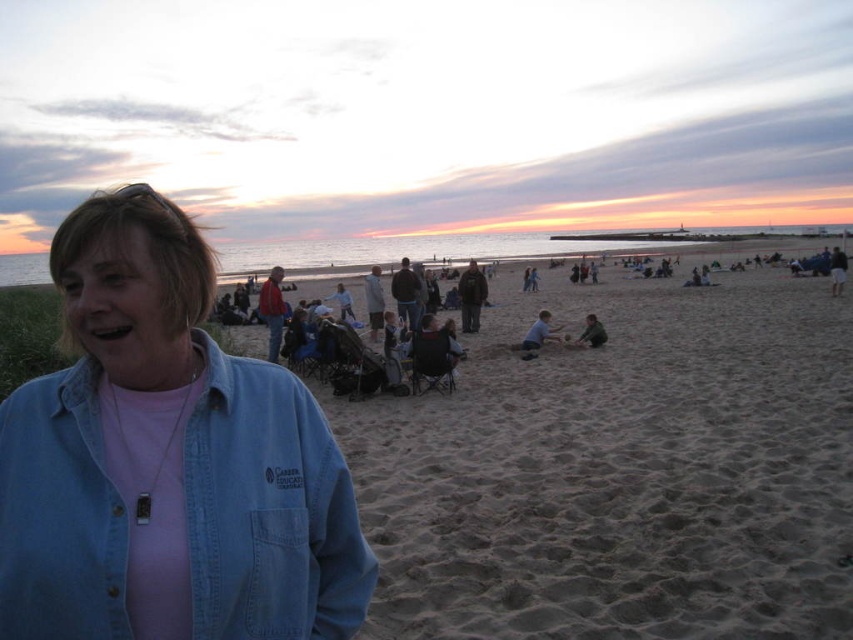
Question: Estimate the real-world distances between objects in this image. Which object is farther from the light brown sand at center?

Choices:
 (A) dark gray pants at right
 (B) denim jacket at lower left

Answer: (A)

Question: Is light brown sand at center positioned before smooth sand at lower center?

Choices:
 (A) no
 (B) yes

Answer: (B)

Question: Among these points, which one is farthest from the camera?

Choices:
 (A) (753, 273)
 (B) (96, 353)
 (C) (834, 275)

Answer: (A)

Question: In this image, where is dark gray pants at right located relative to dark gray fabric child at center?

Choices:
 (A) left
 (B) right

Answer: (B)

Question: Does light brown sand at center appear under denim jacket at lower left?

Choices:
 (A) no
 (B) yes

Answer: (A)

Question: Which point appears farthest from the camera in this image?

Choices:
 (A) click(216, 442)
 (B) click(593, 333)

Answer: (B)